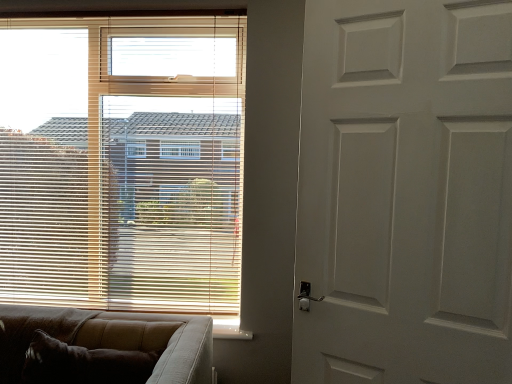
Question: From the image's perspective, would you say brown textured couch at lower left is positioned over white matte door at right?

Choices:
 (A) no
 (B) yes

Answer: (A)

Question: Considering the relative positions of brown textured couch at lower left and white matte door at right in the image provided, is brown textured couch at lower left to the left of white matte door at right from the viewer's perspective?

Choices:
 (A) no
 (B) yes

Answer: (B)

Question: Is brown textured couch at lower left shorter than white matte door at right?

Choices:
 (A) yes
 (B) no

Answer: (A)

Question: Is there a large distance between brown textured couch at lower left and white matte door at right?

Choices:
 (A) no
 (B) yes

Answer: (A)

Question: Is brown textured couch at lower left beside white matte door at right?

Choices:
 (A) yes
 (B) no

Answer: (B)

Question: Considering their positions, is white matte door at right located in front of or behind brown textured couch at lower left?

Choices:
 (A) behind
 (B) front

Answer: (B)

Question: Is white matte door at right wider or thinner than brown textured couch at lower left?

Choices:
 (A) thin
 (B) wide

Answer: (A)

Question: Is white matte door at right taller or shorter than brown textured couch at lower left?

Choices:
 (A) short
 (B) tall

Answer: (B)

Question: From a real-world perspective, is white matte door at right physically located above or below brown textured couch at lower left?

Choices:
 (A) above
 (B) below

Answer: (A)

Question: In the image, is brown textured couch at lower left positioned in front of or behind white matte door at right?

Choices:
 (A) front
 (B) behind

Answer: (B)

Question: Based on their sizes in the image, would you say brown textured couch at lower left is bigger or smaller than white matte door at right?

Choices:
 (A) small
 (B) big

Answer: (B)

Question: Is brown textured couch at lower left wider or thinner than white matte door at right?

Choices:
 (A) wide
 (B) thin

Answer: (A)

Question: Based on their positions, is brown textured couch at lower left located to the left or right of white matte door at right?

Choices:
 (A) left
 (B) right

Answer: (A)

Question: Considering the positions of wooden blinds at upper left and brown textured couch at lower left in the image, is wooden blinds at upper left taller or shorter than brown textured couch at lower left?

Choices:
 (A) tall
 (B) short

Answer: (A)

Question: From a real-world perspective, relative to brown textured couch at lower left, is wooden blinds at upper left vertically above or below?

Choices:
 (A) above
 (B) below

Answer: (A)